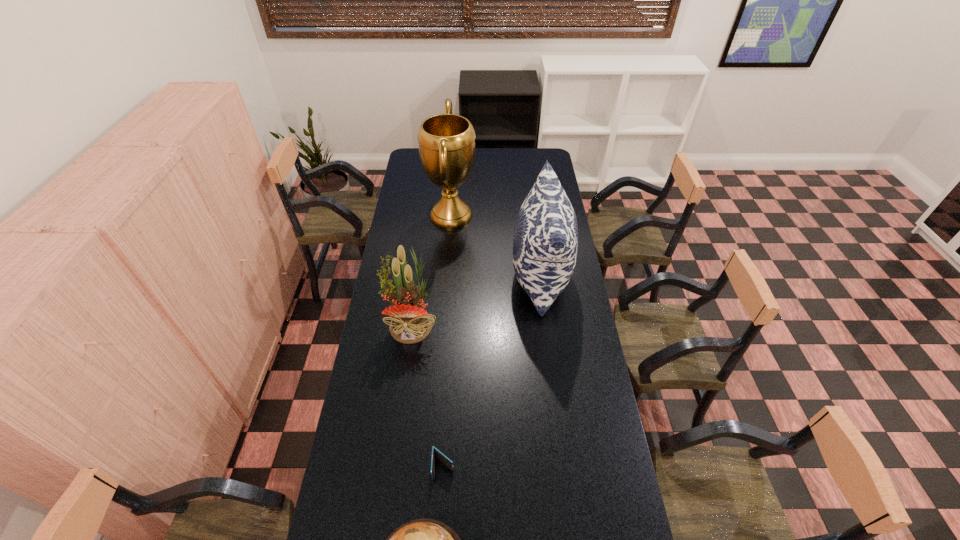
This screenshot has height=540, width=960. In order to click on free spot between the flower arrangement and the cushion in this screenshot , I will do `click(476, 300)`.

Find the location of a particular element. The image size is (960, 540). vacant space in between the rightmost object and the tallest object is located at coordinates (495, 246).

Identify which object is the third nearest to the rightmost object. Please provide its 2D coordinates. Your answer should be formatted as a tuple, i.e. [(x, y)], where the tuple contains the x and y coordinates of a point satisfying the conditions above.

[(446, 461)]

Point out which object is positioned as the second nearest to the tallest object. Please provide its 2D coordinates. Your answer should be formatted as a tuple, i.e. [(x, y)], where the tuple contains the x and y coordinates of a point satisfying the conditions above.

[(410, 323)]

The image size is (960, 540). I want to click on vacant space that satisfies the following two spatial constraints: 1. on the surface of the trophy cup with symbols; 2. in front of the flower arrangement with the fan visible, so click(x=444, y=322).

The height and width of the screenshot is (540, 960). What are the coordinates of `vacant point that satisfies the following two spatial constraints: 1. on the surface of the tallest object with symbols; 2. in front of the flower arrangement with the fan visible` in the screenshot? It's located at (444, 322).

Identify the location of free location that satisfies the following two spatial constraints: 1. on the surface of the tallest object with symbols; 2. in front of the flower arrangement with the fan visible. (444, 322).

In order to click on vacant area that satisfies the following two spatial constraints: 1. on the front surface of the cushion; 2. in front of the flower arrangement with the fan visible in this screenshot , I will do `click(546, 322)`.